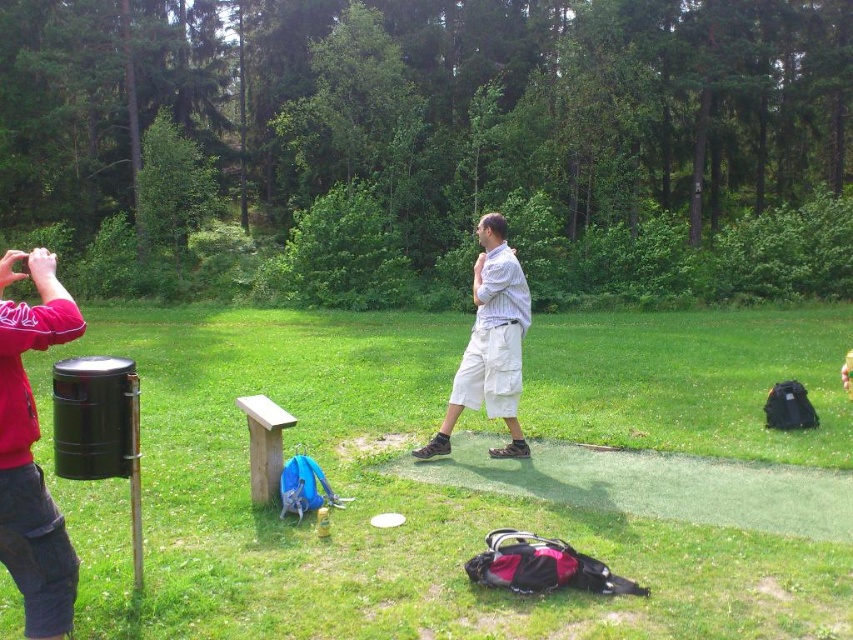
Question: Which point is farther from the camera taking this photo?

Choices:
 (A) (73, 573)
 (B) (422, 445)

Answer: (B)

Question: Which object is closer to the camera taking this photo?

Choices:
 (A) matte red shirt at left
 (B) white cotton shirt at center

Answer: (A)

Question: Can you confirm if matte red shirt at left is bigger than white cotton shirt at center?

Choices:
 (A) no
 (B) yes

Answer: (A)

Question: Does matte red shirt at left appear under white cotton shirt at center?

Choices:
 (A) yes
 (B) no

Answer: (A)

Question: Does matte red shirt at left lie behind white cotton shirt at center?

Choices:
 (A) yes
 (B) no

Answer: (B)